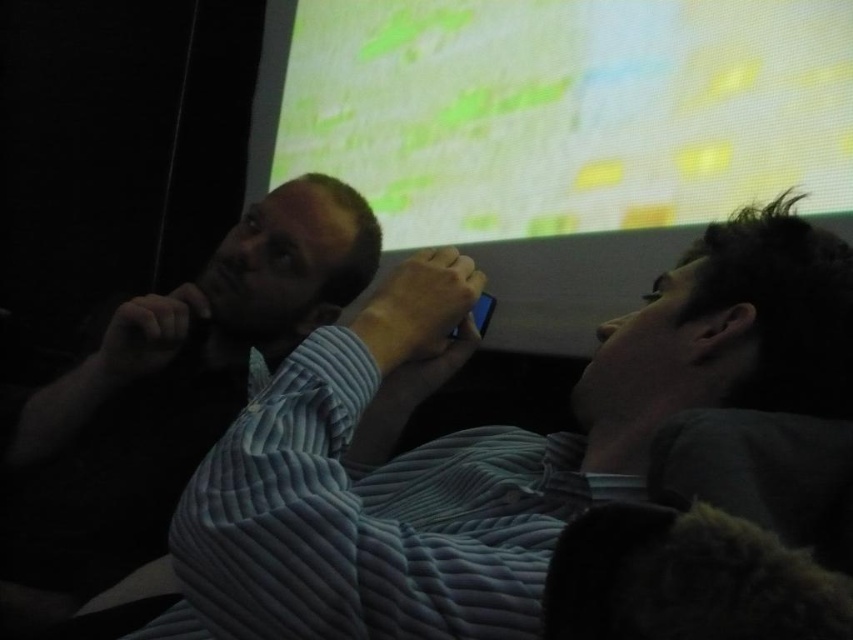
Does blue corduroy shirt at center have a lesser height compared to blue striped shirt at left?

Indeed, blue corduroy shirt at center has a lesser height compared to blue striped shirt at left.

Is blue corduroy shirt at center wider than blue striped shirt at left?

Yes.

Between point (700, 243) and point (65, 524), which one is positioned behind?

Positioned behind is point (65, 524).

Locate an element on the screen. blue corduroy shirt at center is located at coordinates (483, 444).